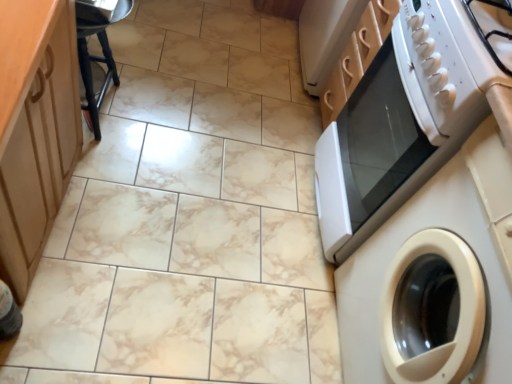
Question: Is black plastic bar stool at upper left not near white glossy gas stove at upper right?

Choices:
 (A) yes
 (B) no

Answer: (B)

Question: Does black plastic bar stool at upper left have a lesser height compared to white glossy gas stove at upper right?

Choices:
 (A) no
 (B) yes

Answer: (A)

Question: Is black plastic bar stool at upper left at the right side of white glossy gas stove at upper right?

Choices:
 (A) no
 (B) yes

Answer: (A)

Question: Can you confirm if black plastic bar stool at upper left is wider than white glossy gas stove at upper right?

Choices:
 (A) yes
 (B) no

Answer: (B)

Question: From the image's perspective, is black plastic bar stool at upper left located above white glossy gas stove at upper right?

Choices:
 (A) no
 (B) yes

Answer: (B)

Question: Is black plastic bar stool at upper left closer to camera compared to white glossy gas stove at upper right?

Choices:
 (A) yes
 (B) no

Answer: (B)

Question: Is white glossy washing machine at right at the right side of white glossy gas stove at upper right?

Choices:
 (A) yes
 (B) no

Answer: (A)

Question: Are white glossy washing machine at right and white glossy gas stove at upper right located far from each other?

Choices:
 (A) yes
 (B) no

Answer: (B)

Question: From the image's perspective, would you say white glossy washing machine at right is shown under white glossy gas stove at upper right?

Choices:
 (A) no
 (B) yes

Answer: (B)

Question: Can you confirm if white glossy washing machine at right is bigger than white glossy gas stove at upper right?

Choices:
 (A) yes
 (B) no

Answer: (A)

Question: Is white glossy washing machine at right beside white glossy gas stove at upper right?

Choices:
 (A) no
 (B) yes

Answer: (A)

Question: Is white glossy gas stove at upper right at the back of white glossy washing machine at right?

Choices:
 (A) no
 (B) yes

Answer: (A)

Question: Does white glossy washing machine at right lie in front of black plastic bar stool at upper left?

Choices:
 (A) yes
 (B) no

Answer: (A)